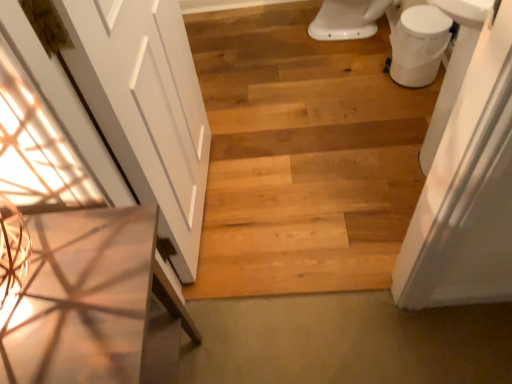
Find the location of a particular element. The width and height of the screenshot is (512, 384). vacant space to the right of natural wood plank at center is located at coordinates (358, 247).